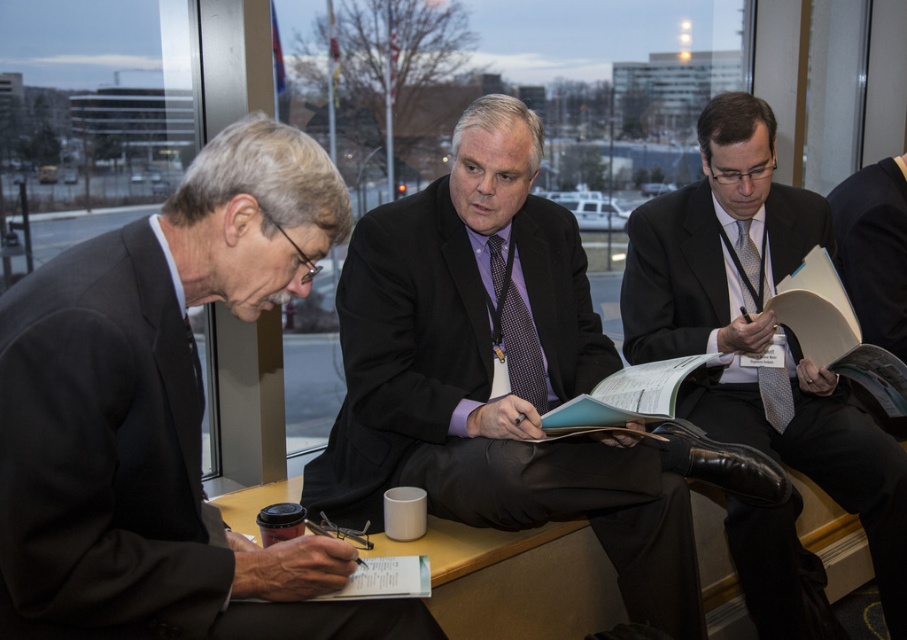
You are an interior designer observing this professional meeting scene. You need to determine the spatial relationship between the matte black suit at center and the silver textured tie at center right. Which object is positioned higher in the image?

The matte black suit at center is taller than the silver textured tie at center right, so the matte black suit at center is positioned higher in the image.

Consider the image. You are an interior designer observing the scene. You need to determine which object is shorter between the matte purple tie at center and the matte black suit at center. Which one is shorter?

The matte purple tie at center is not as tall as the matte black suit at center, so the matte purple tie at center is shorter.

You are a photographer trying to capture a candid shot of the matte black suit at center and the silver textured tie at center right. Since you want to ensure both are visible in the frame, can you determine which one is lower in the image?

The matte black suit at center is positioned under the silver textured tie at center right, so the matte black suit at center is lower in the image.